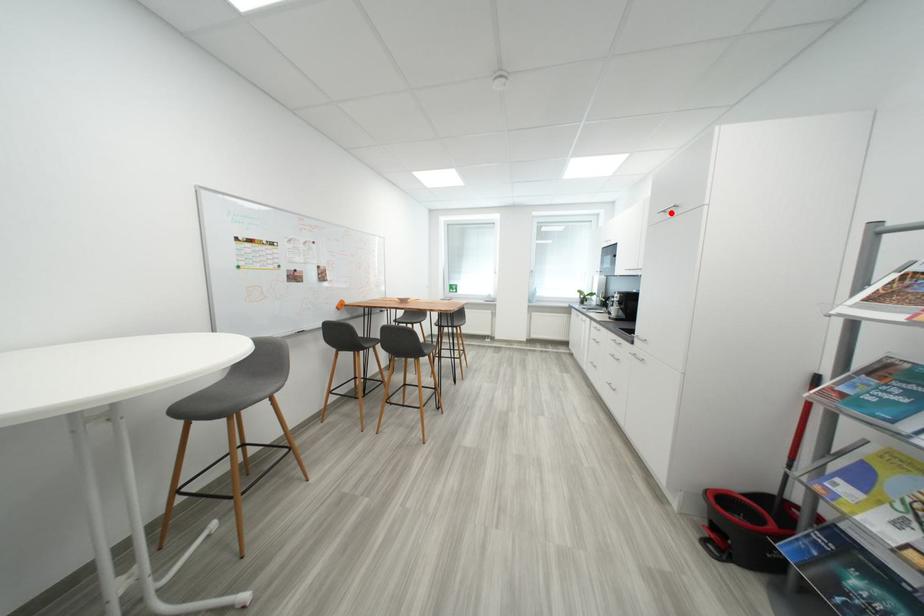
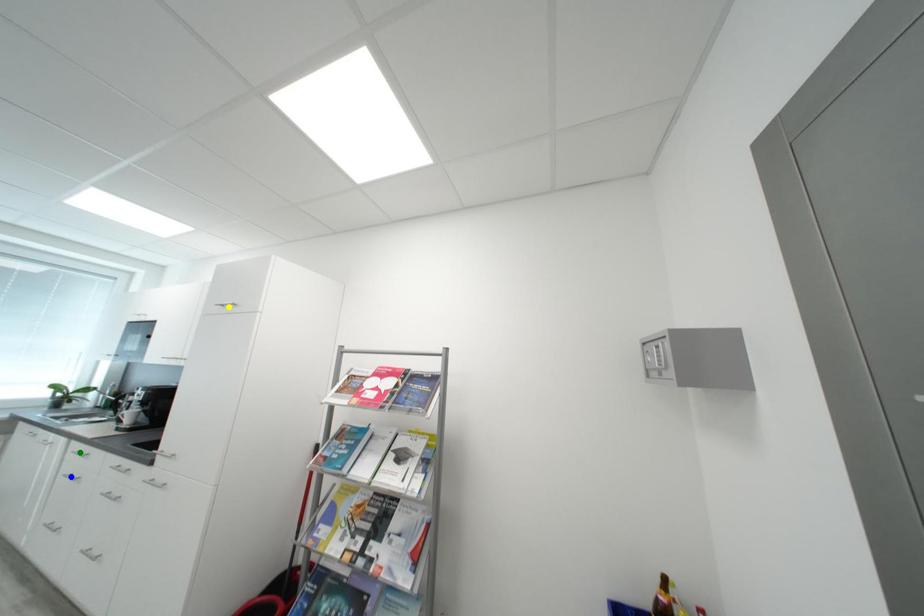
Question: I am providing you with two images of the same scene from different viewpoints. A red point is marked on the first image. You are given multiple points on the second image. Which point in image 2 is actually the same real-world point as the red point in image 1?

Choices:
 (A) yellow point
 (B) blue point
 (C) green point

Answer: (A)